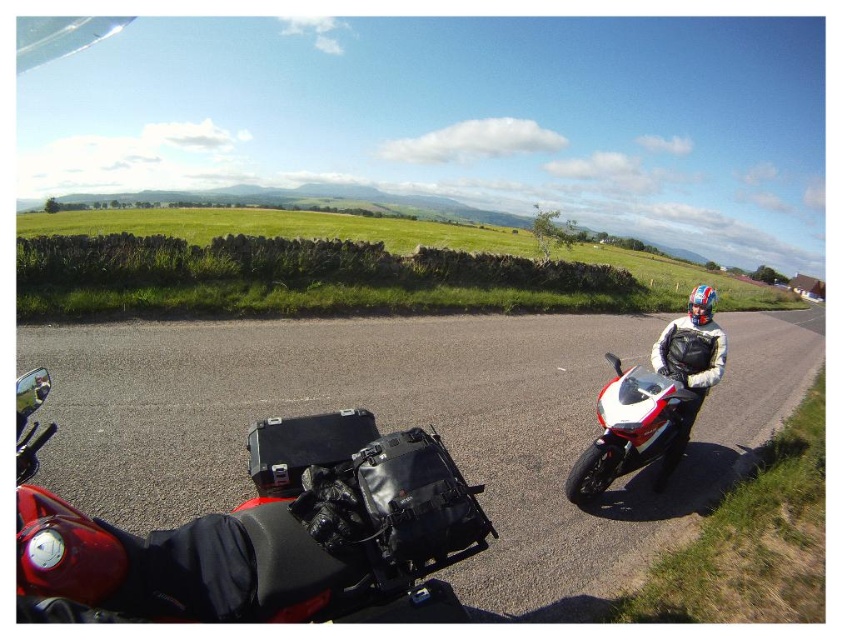
Who is more forward, (232, 612) or (663, 440)?

Positioned in front is point (232, 612).

Looking at this image, who is more forward, (x=24, y=400) or (x=611, y=408)?

Point (x=24, y=400)

Identify the location of shiny black motorcycle at center. This screenshot has width=842, height=640. (264, 532).

Can you confirm if green stone wall at center is thinner than white leather jacket at right?

No, green stone wall at center is not thinner than white leather jacket at right.

I want to click on green stone wall at center, so click(x=329, y=268).

Which is more to the left, shiny black motorcycle at center or green stone wall at center?

green stone wall at center

Who is lower down, shiny black motorcycle at center or green stone wall at center?

shiny black motorcycle at center is below.

The height and width of the screenshot is (640, 842). What do you see at coordinates (264, 532) in the screenshot?
I see `shiny black motorcycle at center` at bounding box center [264, 532].

What are the coordinates of `shiny black motorcycle at center` in the screenshot? It's located at (264, 532).